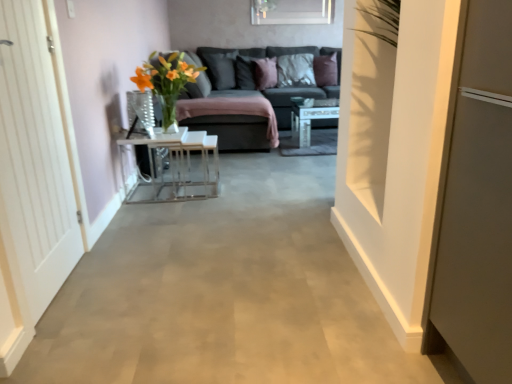
Question: From the image's perspective, is purple velvet pillow at center, the third pillow viewed from the right, over clear glass vase at center?

Choices:
 (A) no
 (B) yes

Answer: (B)

Question: From a real-world perspective, is purple velvet pillow at center, the third pillow viewed from the right, located beneath clear glass vase at center?

Choices:
 (A) yes
 (B) no

Answer: (B)

Question: Considering the relative sizes of purple velvet pillow at center, the third pillow viewed from the right, and clear glass vase at center in the image provided, is purple velvet pillow at center, the third pillow viewed from the right, bigger than clear glass vase at center?

Choices:
 (A) yes
 (B) no

Answer: (A)

Question: Is purple velvet pillow at center, the 3th pillow when ordered from left to right, oriented towards clear glass vase at center?

Choices:
 (A) no
 (B) yes

Answer: (A)

Question: Can you confirm if purple velvet pillow at center, the third pillow viewed from the right, is taller than clear glass vase at center?

Choices:
 (A) no
 (B) yes

Answer: (B)

Question: Does point (128, 100) appear closer or farther from the camera than point (154, 165)?

Choices:
 (A) closer
 (B) farther

Answer: (A)

Question: From a real-world perspective, is clear glass vase at center positioned above or below metallic white table at center?

Choices:
 (A) above
 (B) below

Answer: (A)

Question: From the image's perspective, is clear glass vase at center above or below metallic white table at center?

Choices:
 (A) below
 (B) above

Answer: (B)

Question: Considering the positions of clear glass vase at center and metallic white table at center in the image, is clear glass vase at center wider or thinner than metallic white table at center?

Choices:
 (A) thin
 (B) wide

Answer: (A)

Question: In terms of size, does suede-like gray pillow at center, the fifth pillow in the right-to-left sequence, appear bigger or smaller than velvet dark gray pillow at upper center, positioned as the fourth pillow in right-to-left order?

Choices:
 (A) big
 (B) small

Answer: (A)

Question: From a real-world perspective, relative to velvet dark gray pillow at upper center, positioned as the fourth pillow in right-to-left order, is suede-like gray pillow at center, the fifth pillow in the right-to-left sequence, vertically above or below?

Choices:
 (A) above
 (B) below

Answer: (A)

Question: Considering the positions of suede-like gray pillow at center, placed as the 1th pillow when sorted from left to right, and velvet dark gray pillow at upper center, which appears as the 2th pillow when viewed from the left, in the image, is suede-like gray pillow at center, placed as the 1th pillow when sorted from left to right, wider or thinner than velvet dark gray pillow at upper center, which appears as the 2th pillow when viewed from the left,?

Choices:
 (A) thin
 (B) wide

Answer: (B)

Question: Based on their positions, is suede-like gray pillow at center, placed as the 1th pillow when sorted from left to right, located to the left or right of velvet dark gray pillow at upper center, which appears as the 2th pillow when viewed from the left?

Choices:
 (A) right
 (B) left

Answer: (B)

Question: In the image, is white wooden door at left positioned in front of or behind velvet dark gray pillow at upper center, which appears as the 2th pillow when viewed from the left?

Choices:
 (A) behind
 (B) front

Answer: (B)

Question: Do you think white wooden door at left is within velvet dark gray pillow at upper center, which appears as the 2th pillow when viewed from the left, or outside of it?

Choices:
 (A) inside
 (B) outside

Answer: (B)